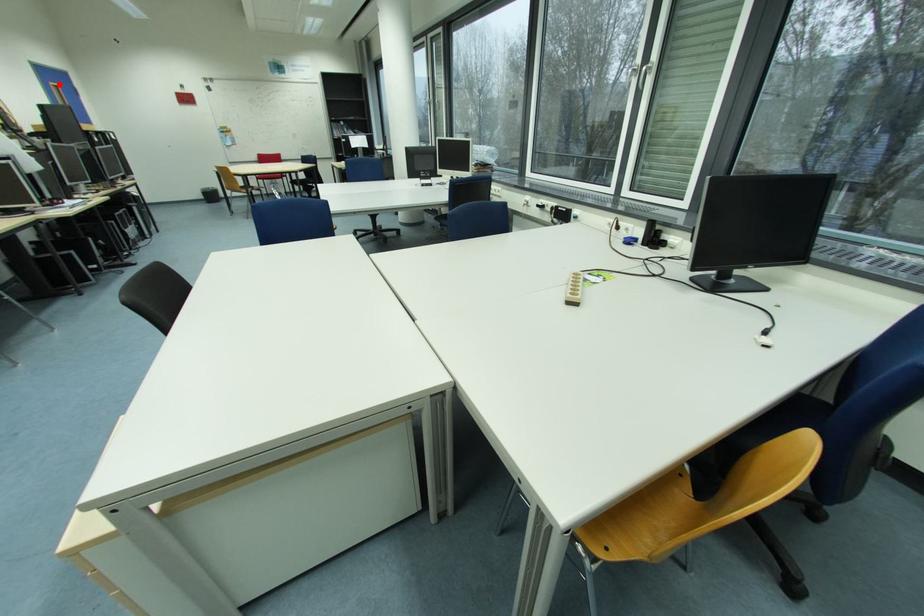
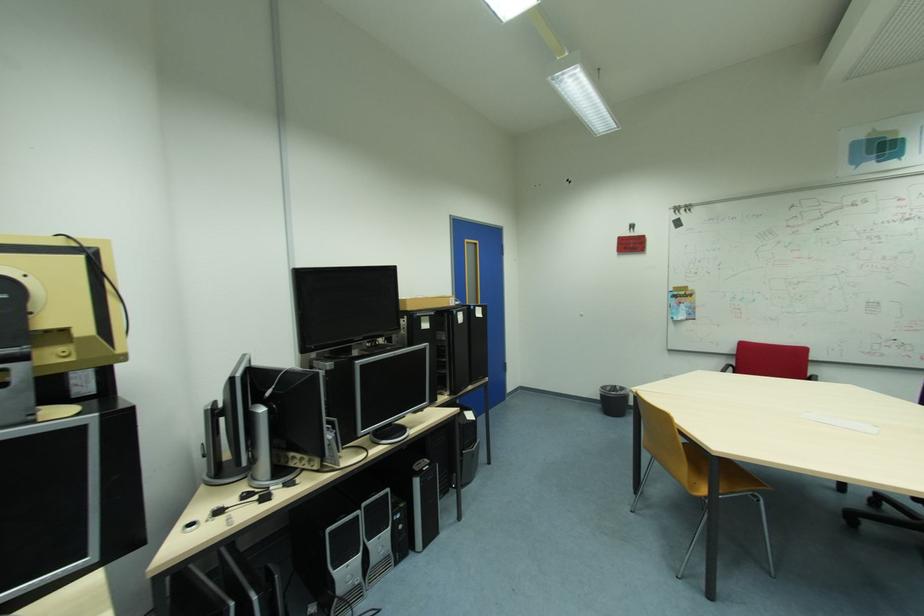
Find the pixel in the second image that matches the highlighted location in the first image.

(473, 241)